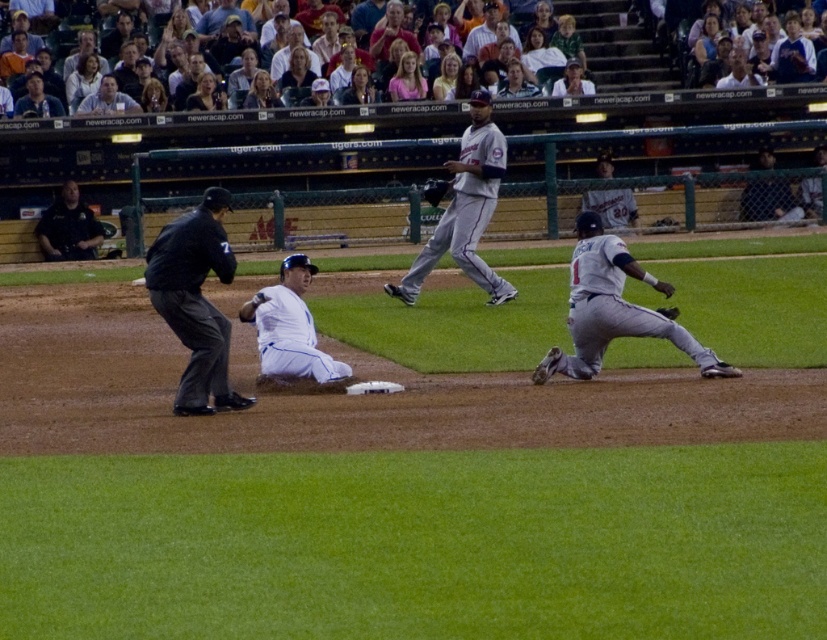
You are a photographer trying to capture a clear shot of the dark blue shirt at upper left and the dark gray leather glove at center. Based on their positions, which object is closer to the camera?

The dark blue shirt at upper left is closer to the camera because it is positioned over the dark gray leather glove at center, indicating it is in front.

You are a sports analyst watching the baseball game. You notice the gray uniformed player at center and the white jersey at center. Which player is closer to the left side of the field?

The gray uniformed player at center is positioned on the left side of white jersey at center, so the gray uniformed player at center is closer to the left side of the field.